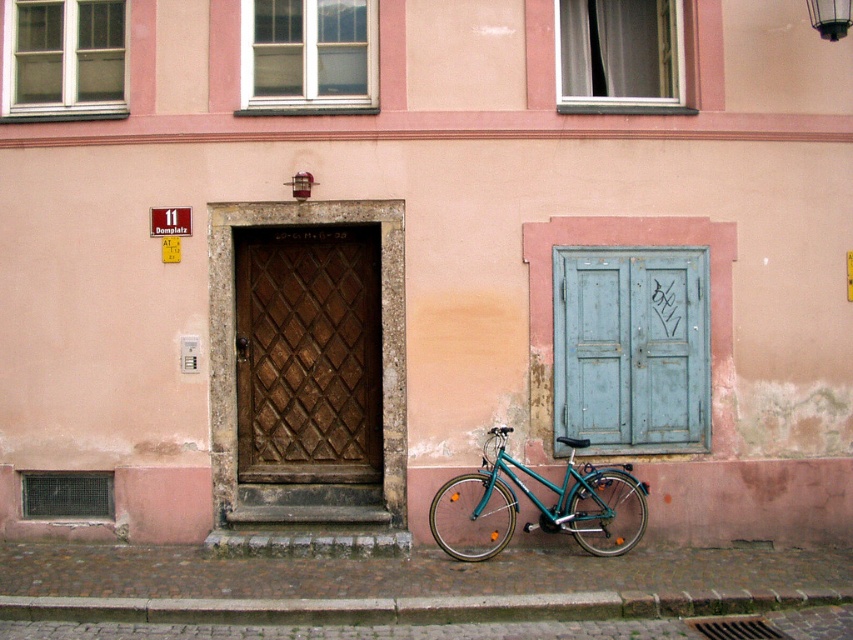
Between point (611, 502) and point (584, 58), which one is positioned behind?

The point (584, 58) is behind.

Who is positioned more to the right, teal metallic bicycle at lower center or gray fabric shutter at upper center?

gray fabric shutter at upper center is more to the right.

Does point (608, 520) come farther from viewer compared to point (662, 84)?

No, it is not.

I want to click on teal metallic bicycle at lower center, so click(538, 506).

Does blue painted wood door at right appear under green painted wood window at upper left?

Indeed, blue painted wood door at right is positioned under green painted wood window at upper left.

Is blue painted wood door at right further to camera compared to green painted wood window at upper left?

No, it is not.

Locate an element on the screen. blue painted wood door at right is located at coordinates (631, 348).

Can you confirm if brown textured door at center is shorter than gray fabric shutter at upper center?

In fact, brown textured door at center may be taller than gray fabric shutter at upper center.

Does brown textured door at center come behind gray fabric shutter at upper center?

No.

Between point (334, 257) and point (650, 28), which one is positioned behind?

The point (650, 28) is behind.

Find the location of a particular element. The height and width of the screenshot is (640, 853). brown textured door at center is located at coordinates (308, 355).